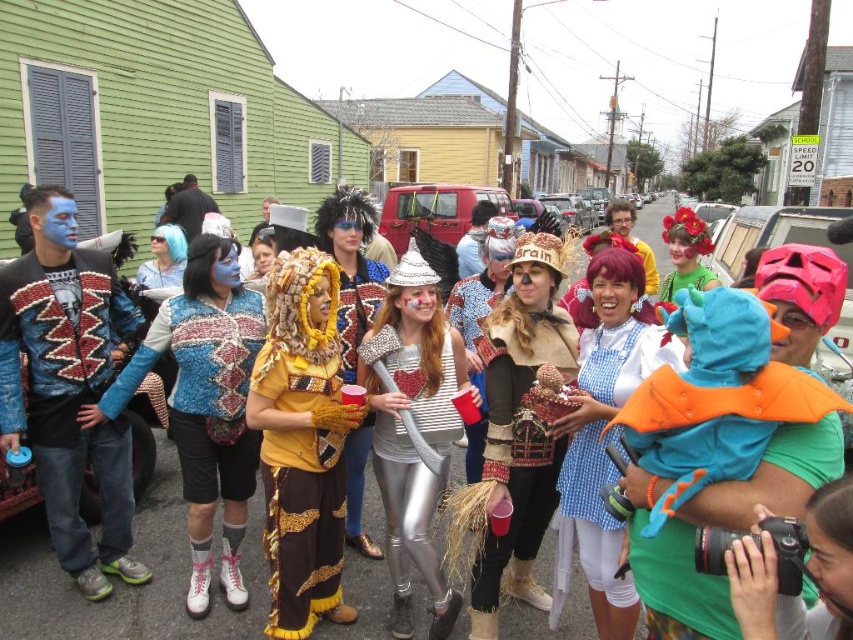
You are a photographer trying to capture both the matte blue face paint at left and the beaded fabric scarecrow at center in a single frame. Which object should you focus on first to ensure both are in the shot?

The matte blue face paint at left should be focused on first since it is larger in size compared to the beaded fabric scarecrow at center, allowing the photographer to frame both effectively.

You are a photographer trying to capture a clear photo of the gold sequined pants at center and the shiny metallic costume at center. Since you want both subjects in focus, which one should you position closer to the camera to ensure they are both sharp?

To ensure both the gold sequined pants at center and the shiny metallic costume at center are in focus, position the gold sequined pants at center closer to the camera. Since the gold sequined pants at center is behind the shiny metallic costume at center, moving it forward will help align their focus planes.